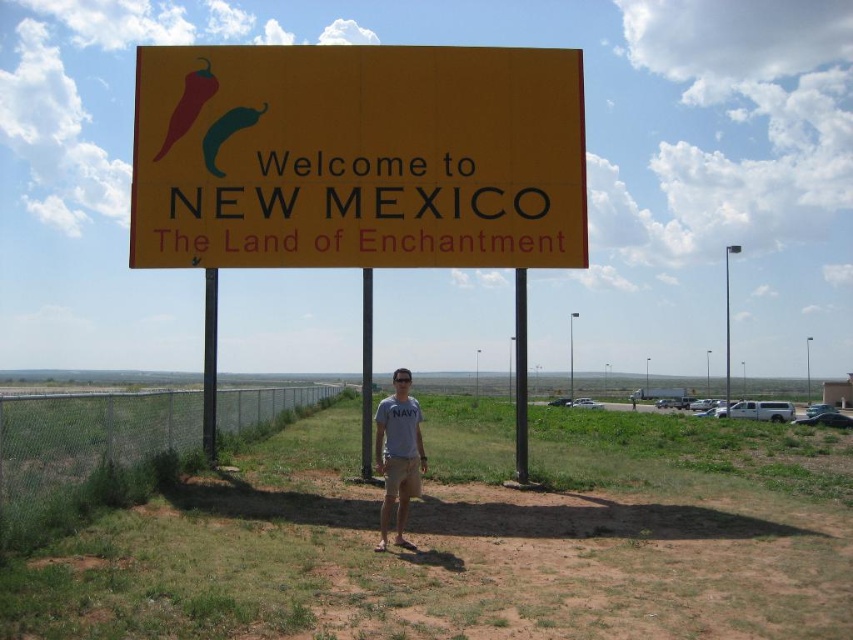
Does gray cotton shirt at center appear under green matte chili pepper at upper center?

Yes, gray cotton shirt at center is below green matte chili pepper at upper center.

Is gray cotton shirt at center behind green matte chili pepper at upper center?

No.

This screenshot has width=853, height=640. Describe the element at coordinates (398, 456) in the screenshot. I see `gray cotton shirt at center` at that location.

Find the location of a particular element. The image size is (853, 640). gray cotton shirt at center is located at coordinates pyautogui.click(x=398, y=456).

Is matte red pepper at upper left below green matte chili pepper at upper center?

No.

Can you confirm if matte red pepper at upper left is positioned to the left of green matte chili pepper at upper center?

Correct, you'll find matte red pepper at upper left to the left of green matte chili pepper at upper center.

Measure the distance between matte red pepper at upper left and camera.

matte red pepper at upper left is 14.50 meters from camera.

You are a GUI agent. You are given a task and a screenshot of the screen. Output one action in this format:
    pyautogui.click(x=<x>, y=<y>)
    Task: Click on the matte red pepper at upper left
    The width and height of the screenshot is (853, 640).
    Given the screenshot: What is the action you would take?
    pyautogui.click(x=189, y=104)

Does gray cotton shirt at center appear on the right side of matte red pepper at upper left?

Indeed, gray cotton shirt at center is positioned on the right side of matte red pepper at upper left.

Is point (381, 406) more distant than point (204, 86)?

No, it is in front of (204, 86).

This screenshot has width=853, height=640. I want to click on gray cotton shirt at center, so click(398, 456).